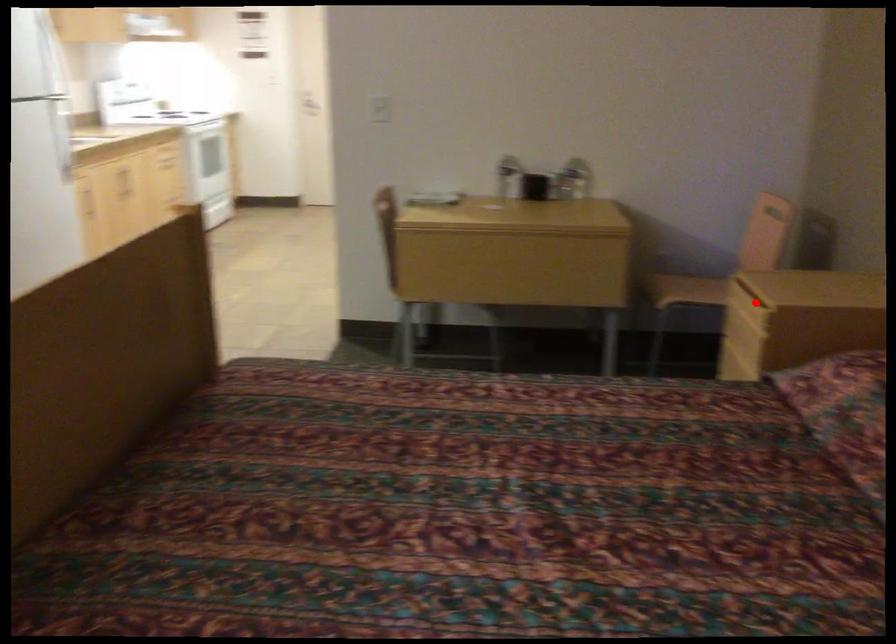
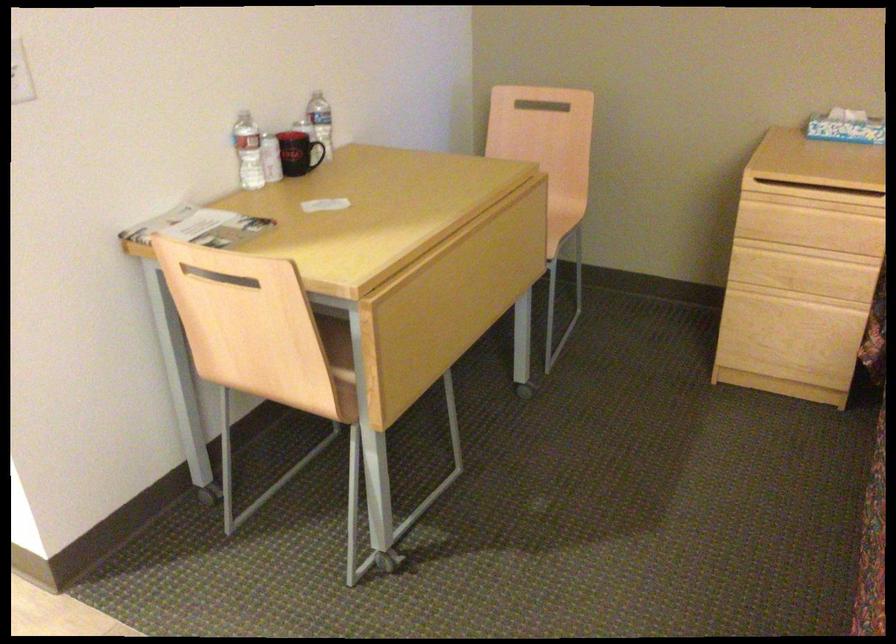
Question: I am providing you with two images of the same scene from different viewpoints. Given a red point in image1, look at the same physical point in image2. Is it:

Choices:
 (A) Closer to the viewpoint
 (B) Farther from the viewpoint

Answer: (A)